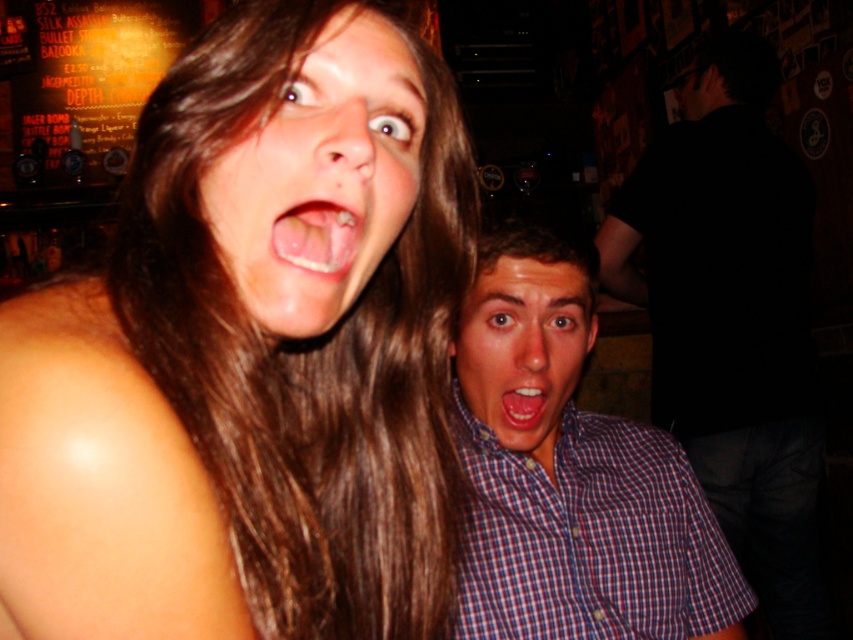
Does black shirt at right appear under checkered fabric face at center?

Actually, black shirt at right is above checkered fabric face at center.

Can you confirm if black shirt at right is positioned above checkered fabric face at center?

Yes, black shirt at right is above checkered fabric face at center.

Describe the element at coordinates (732, 320) in the screenshot. I see `black shirt at right` at that location.

Where is `black shirt at right`? The image size is (853, 640). black shirt at right is located at coordinates (732, 320).

Looking at this image, which of these two, black shirt at right or blue plaid shirt at right, stands taller?

With more height is black shirt at right.

Can you confirm if black shirt at right is positioned to the right of blue plaid shirt at right?

Yes, black shirt at right is to the right of blue plaid shirt at right.

Is point (735, 448) less distant than point (692, 499)?

No, it is not.

Image resolution: width=853 pixels, height=640 pixels. What are the coordinates of `black shirt at right` in the screenshot? It's located at (732, 320).

Who is taller, brown hair at upper left or checkered fabric face at center?

brown hair at upper left

Which is above, brown hair at upper left or checkered fabric face at center?

Positioned higher is brown hair at upper left.

Which is behind, point (372, 8) or point (547, 268)?

The point (547, 268) is more distant.

Identify the location of brown hair at upper left. (250, 355).